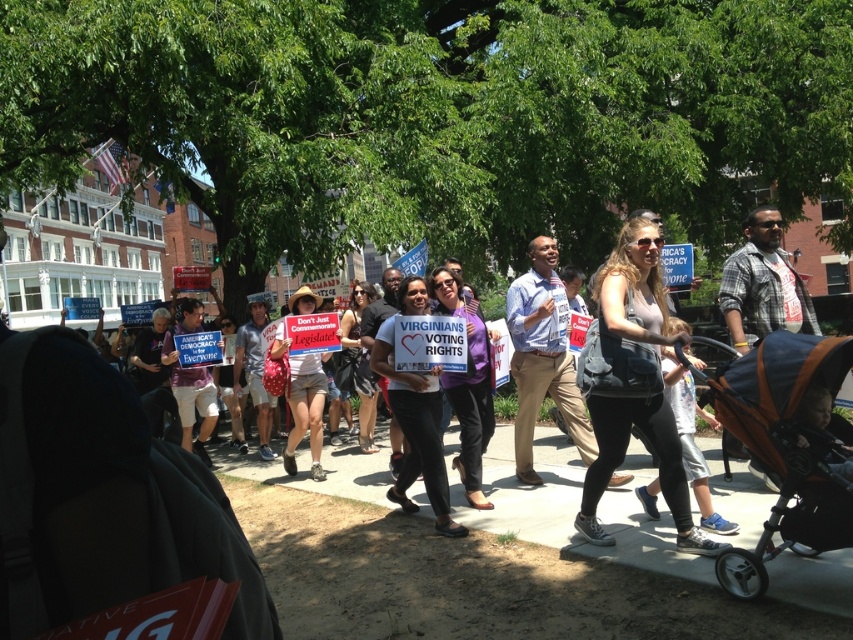
You are a photographer at the protest and want to capture both the denim jacket at center and the denim shorts at center in a single photo. Since you can only focus on one object, which one should you focus on to ensure both are in the frame?

The denim jacket at center is positioned on the right side of denim shorts at center, so focusing on the denim shorts at center would allow both objects to be captured in the frame since the jacket is to the right of the shorts.

You are a photographer trying to capture a clear photo of the denim jacket at center and denim shorts at center. If the jacket is wider than the shorts, would you need to adjust your camera angle to avoid the jacket blocking the shorts?

The denim jacket at center might be wider than denim shorts at center, so adjusting the camera angle could help ensure both items are visible without obstruction.

You are a photographer standing at the center of the protest scene. You want to take a photo that includes both the point at [785,513] and the point at [647,228]. Which of these two points will appear closer to the camera in your photo?

Point at [785,513] will appear closer to the camera because it is closer to the viewer than point at [647,228].